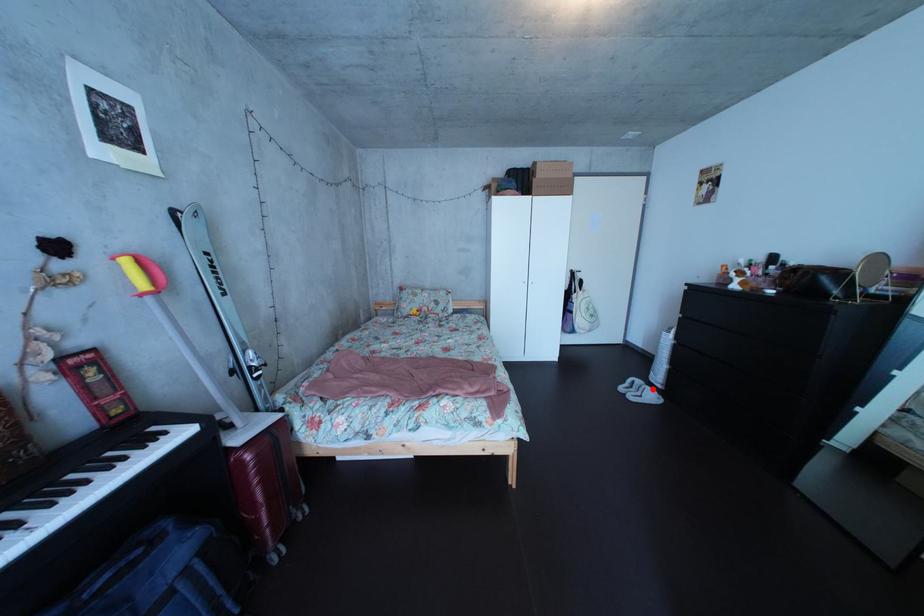
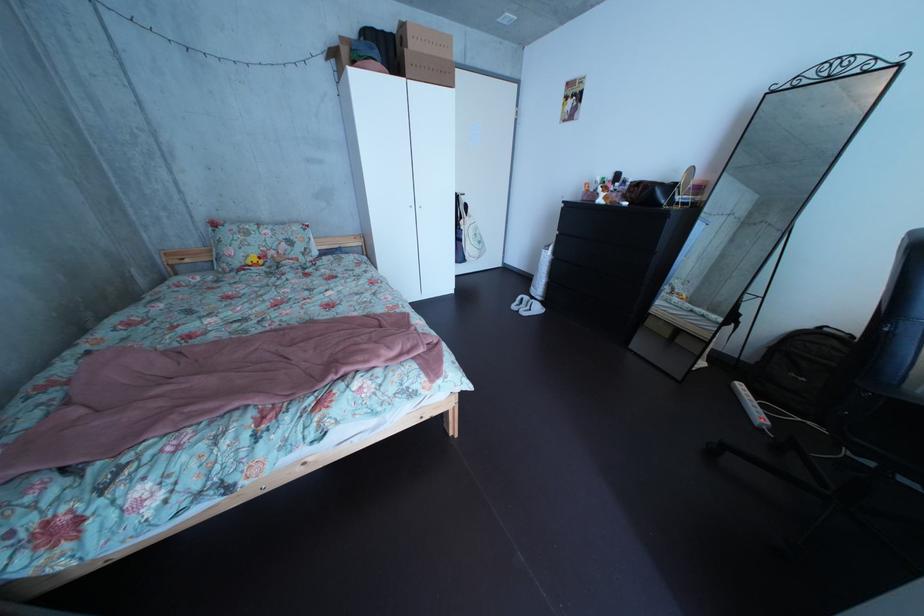
Locate, in the second image, the point that corresponds to the highlighted location in the first image.

(541, 306)